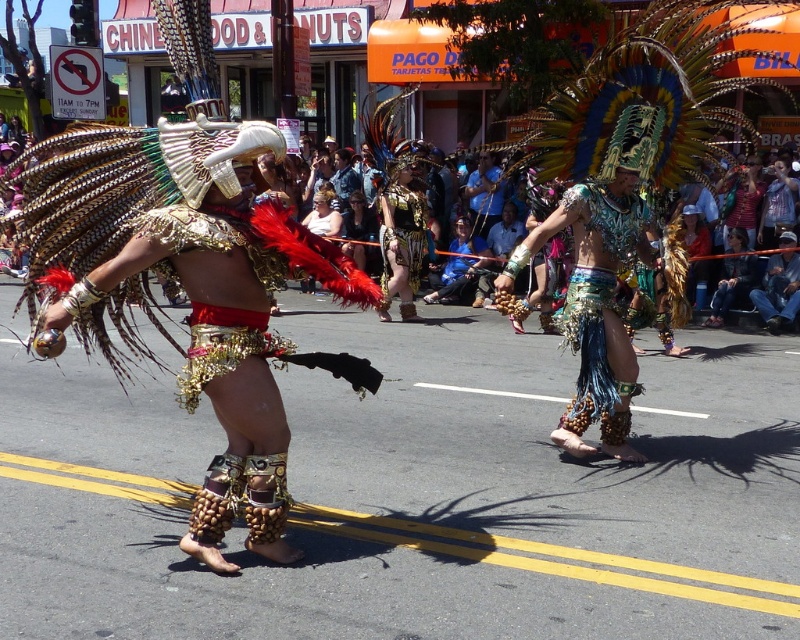
Is point (616, 244) positioned in front of point (394, 196)?

Yes, it is in front of point (394, 196).

From the picture: Can you confirm if shiny metallic headdress at center is positioned to the right of metallic gold armor at center?

Indeed, shiny metallic headdress at center is positioned on the right side of metallic gold armor at center.

Identify the location of shiny metallic headdress at center. (600, 282).

Is shiny gold feathers at center positioned in front of metallic gold armor at center?

Yes.

Which of these two, shiny gold feathers at center or metallic gold armor at center, stands taller?

shiny gold feathers at center is taller.

You are a GUI agent. You are given a task and a screenshot of the screen. Output one action in this format:
    pyautogui.click(x=<x>, y=<y>)
    Task: Click on the shiny gold feathers at center
    Image resolution: width=800 pixels, height=640 pixels.
    Given the screenshot: What is the action you would take?
    pyautogui.click(x=194, y=291)

Find the location of a particular element. Image resolution: width=800 pixels, height=640 pixels. shiny gold feathers at center is located at coordinates (194, 291).

Is point (620, 164) behind point (605, 212)?

No, (620, 164) is in front of (605, 212).

Describe the element at coordinates (600, 282) in the screenshot. The width and height of the screenshot is (800, 640). I see `shiny metallic headdress at center` at that location.

The height and width of the screenshot is (640, 800). Identify the location of shiny metallic headdress at center. (600, 282).